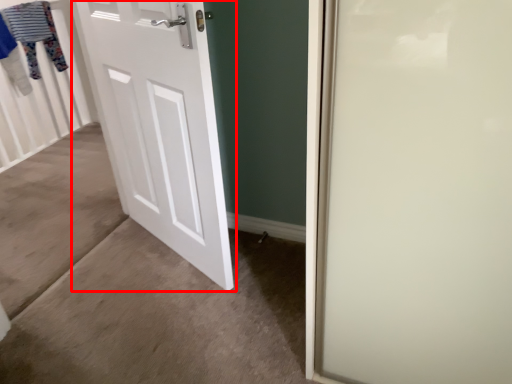
Question: From the image's perspective, what is the correct spatial positioning of door (annotated by the red box) in reference to clothesline?

Choices:
 (A) below
 (B) above

Answer: (A)